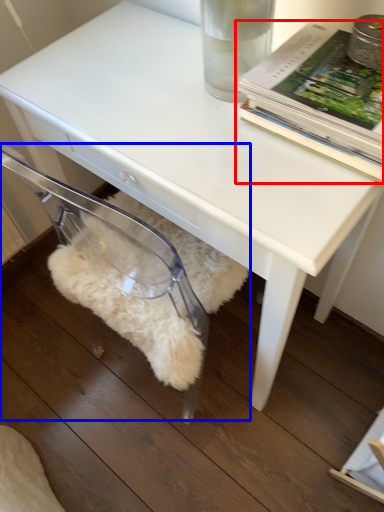
Question: Among these objects, which one is farthest to the camera, book (highlighted by a red box) or swivel chair (highlighted by a blue box)?

Choices:
 (A) book
 (B) swivel chair

Answer: (B)